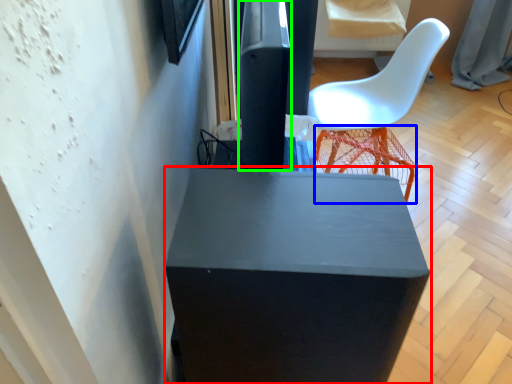
Question: Based on their relative distances, which object is farther from furniture (highlighted by a red box)? Choose from bar stool (highlighted by a blue box) and pillar (highlighted by a green box).

Choices:
 (A) bar stool
 (B) pillar

Answer: (A)